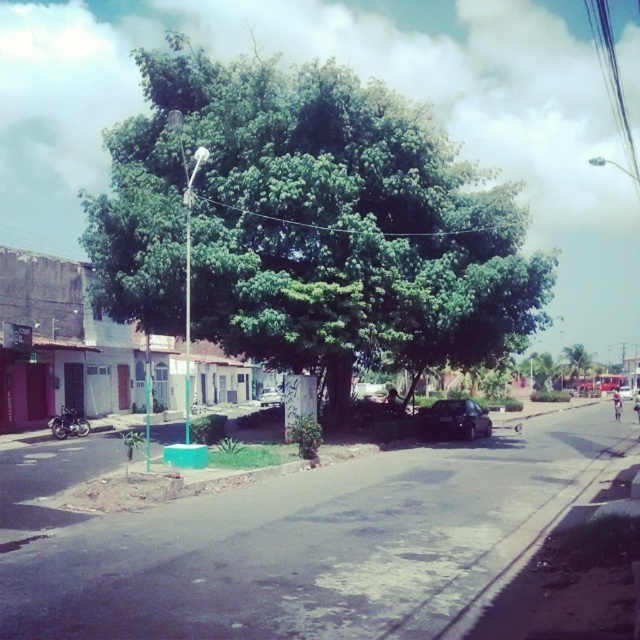
Who is more forward, (196, 250) or (625, 400)?

Point (196, 250) is in front.

Is green leafy tree at center bigger than metallic silver car at center?

Yes, green leafy tree at center is bigger than metallic silver car at center.

The width and height of the screenshot is (640, 640). What do you see at coordinates (308, 224) in the screenshot?
I see `green leafy tree at center` at bounding box center [308, 224].

Identify the location of green leafy tree at center. This screenshot has height=640, width=640. (308, 224).

Which is above, green leafy tree at center or silver metallic car at center?

Positioned higher is green leafy tree at center.

Does point (403, 100) come behind point (280, 403)?

No, (403, 100) is in front of (280, 403).

Between point (176, 118) and point (280, 392), which one is positioned behind?

The point (280, 392) is behind.

Where is `green leafy tree at center`? The height and width of the screenshot is (640, 640). green leafy tree at center is located at coordinates (308, 224).

Measure the distance between black matte car at center and camera.

black matte car at center is 79.98 feet from camera.

Does black matte car at center have a greater height compared to metallic silver car at center?

Yes, black matte car at center is taller than metallic silver car at center.

Describe the element at coordinates (454, 419) in the screenshot. I see `black matte car at center` at that location.

You are a GUI agent. You are given a task and a screenshot of the screen. Output one action in this format:
    pyautogui.click(x=<x>, y=<y>)
    Task: Click on the black matte car at center
    Image resolution: width=640 pixels, height=640 pixels.
    Given the screenshot: What is the action you would take?
    pyautogui.click(x=454, y=419)